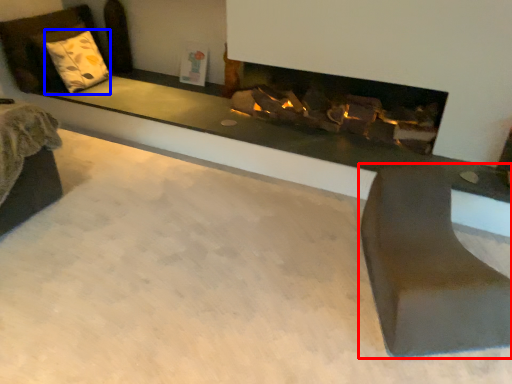
Question: Which of the following is the closest to the observer, furniture (highlighted by a red box) or pillow (highlighted by a blue box)?

Choices:
 (A) furniture
 (B) pillow

Answer: (A)